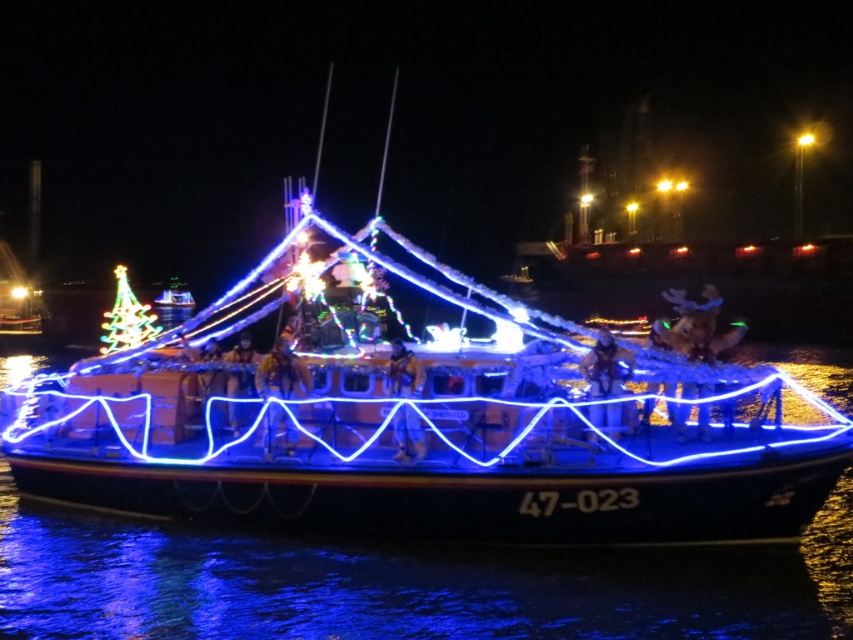
You are a photographer standing on the deck of the boat with the number 47023. You notice the yellow fabric jacket at center and the matte gold helmet at center. Which object is closer to the water?

The yellow fabric jacket at center is positioned under the matte gold helmet at center, so the yellow fabric jacket at center is closer to the water.

You are a photographer standing on the deck of the boat with the number 47023. You see the yellow fabric jacket at center and the matte gold helmet at center. Which object is positioned to the right of the other?

The yellow fabric jacket at center is to the right of the matte gold helmet at center.